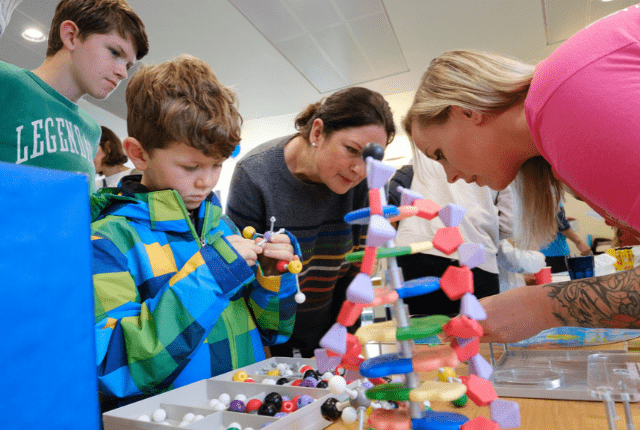
The height and width of the screenshot is (430, 640). I want to click on desk, so click(556, 417).